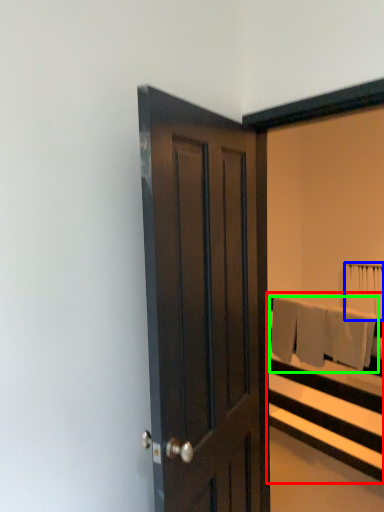
Question: Which object is the farthest from bed frame (highlighted by a red box)? Choose among these: bath towel (highlighted by a blue box) or bath towel (highlighted by a green box).

Choices:
 (A) bath towel
 (B) bath towel

Answer: (A)